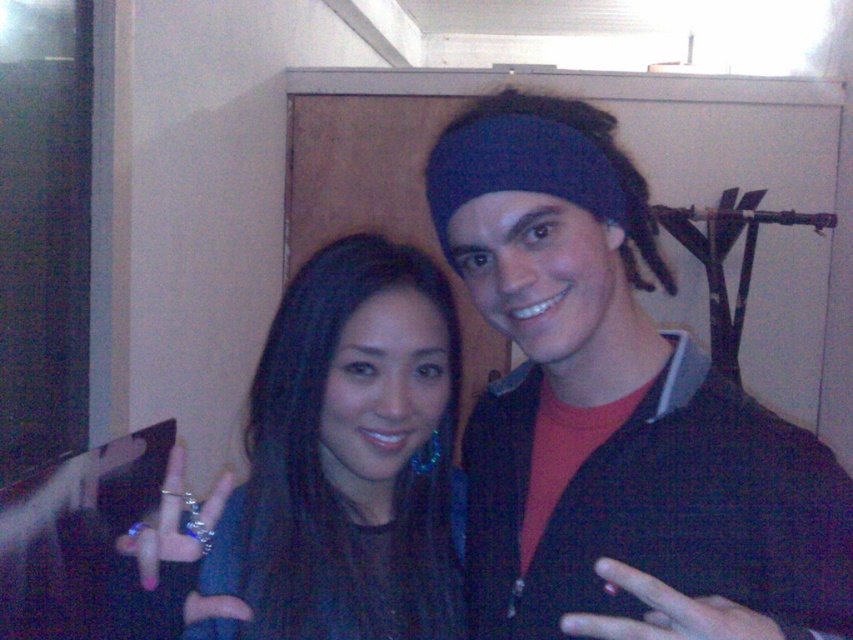
You are an AI analyzing the image. The scene shows two people posing together. Where is the matte black hair at center located in terms of coordinates?

The matte black hair at center is located at coordinates point (650, 515).

You are standing in the room where the two people are posing. You need to place a small decoration exactly at point A and point B. If point A is at coordinates point (563, 513) and point B is at coordinates point (299, 458), which point is closer to you?

Point A at coordinates point (563, 513) is closer to you because it is in front of point B at coordinates point (299, 458).

You are a photographer trying to capture the perfect shot of the two people in the scene. You notice that the matte black hair at center and the satin black hair at center are close together. Which hair type is covering part of the other?

The matte black hair at center is positioned over the satin black hair at center, so it is covering part of the satin black hair at center.